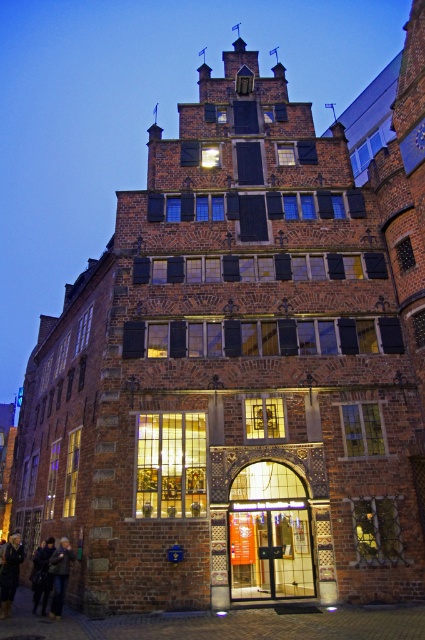
Who is higher up, dark brown leather boots at lower left or dark blue leather jacket at lower left?

dark brown leather boots at lower left

Can you confirm if dark brown leather boots at lower left is smaller than dark blue leather jacket at lower left?

Indeed, dark brown leather boots at lower left has a smaller size compared to dark blue leather jacket at lower left.

What do you see at coordinates (10, 572) in the screenshot? I see `dark brown leather boots at lower left` at bounding box center [10, 572].

You are a GUI agent. You are given a task and a screenshot of the screen. Output one action in this format:
    pyautogui.click(x=<x>, y=<y>)
    Task: Click on the dark brown leather boots at lower left
    The width and height of the screenshot is (425, 640).
    Given the screenshot: What is the action you would take?
    pyautogui.click(x=10, y=572)

Does dark brown leather jacket at lower left come in front of dark blue leather jacket at lower left?

That is True.

Is point (51, 557) positioned after point (34, 602)?

No.

Is point (62, 541) closer to camera compared to point (47, 593)?

No, (62, 541) is further to viewer.

This screenshot has width=425, height=640. In order to click on dark brown leather jacket at lower left in this screenshot , I will do `click(59, 573)`.

Between dark brown leather boots at lower left and dark brown leather jacket at lower left, which one is positioned higher?

dark brown leather jacket at lower left

Find the location of a particular element. The width and height of the screenshot is (425, 640). dark brown leather boots at lower left is located at coordinates (10, 572).